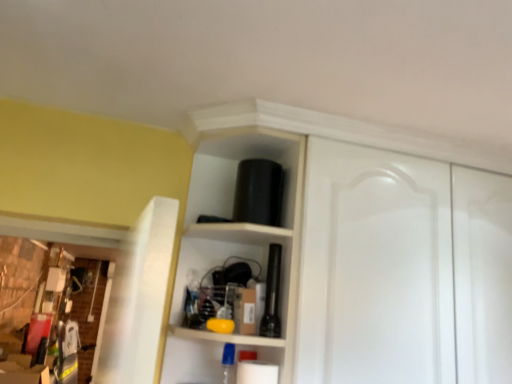
Question: Considering the relative sizes of black matte flashlight at center and white matte cabinet at upper center in the image provided, is black matte flashlight at center smaller than white matte cabinet at upper center?

Choices:
 (A) no
 (B) yes

Answer: (B)

Question: Is black matte flashlight at center positioned far away from white matte cabinet at upper center?

Choices:
 (A) yes
 (B) no

Answer: (B)

Question: Is black matte flashlight at center further to camera compared to white matte cabinet at upper center?

Choices:
 (A) yes
 (B) no

Answer: (A)

Question: Is white matte cabinet at upper center completely or partially inside black matte flashlight at center?

Choices:
 (A) yes
 (B) no

Answer: (B)

Question: Is black matte flashlight at center placed right next to white matte cabinet at upper center?

Choices:
 (A) yes
 (B) no

Answer: (B)

Question: Considering the relative positions of black matte flashlight at center and white matte cabinet at upper center in the image provided, is black matte flashlight at center in front of white matte cabinet at upper center?

Choices:
 (A) no
 (B) yes

Answer: (A)

Question: Does white matte cabinet at upper center contain black matte flashlight at center?

Choices:
 (A) no
 (B) yes

Answer: (B)

Question: Considering the relative sizes of white matte cabinet at upper center and black matte flashlight at center in the image provided, is white matte cabinet at upper center taller than black matte flashlight at center?

Choices:
 (A) yes
 (B) no

Answer: (A)

Question: Considering the relative positions of white matte cabinet at upper center and black matte flashlight at center in the image provided, is white matte cabinet at upper center to the left of black matte flashlight at center from the viewer's perspective?

Choices:
 (A) yes
 (B) no

Answer: (B)

Question: Is white matte cabinet at upper center positioned beyond the bounds of black matte flashlight at center?

Choices:
 (A) no
 (B) yes

Answer: (B)

Question: Is black matte flashlight at center at the back of white matte cabinet at upper center?

Choices:
 (A) yes
 (B) no

Answer: (A)

Question: Are white matte cabinet at upper center and black matte flashlight at center located far from each other?

Choices:
 (A) yes
 (B) no

Answer: (B)

Question: In terms of width, does black matte flashlight at center look wider or thinner when compared to white matte cabinet at upper center?

Choices:
 (A) thin
 (B) wide

Answer: (A)